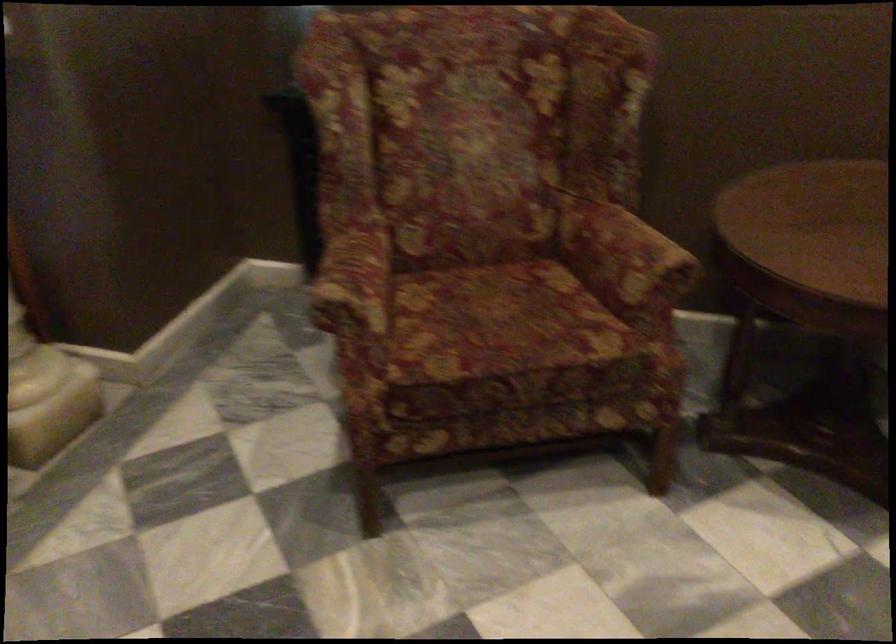
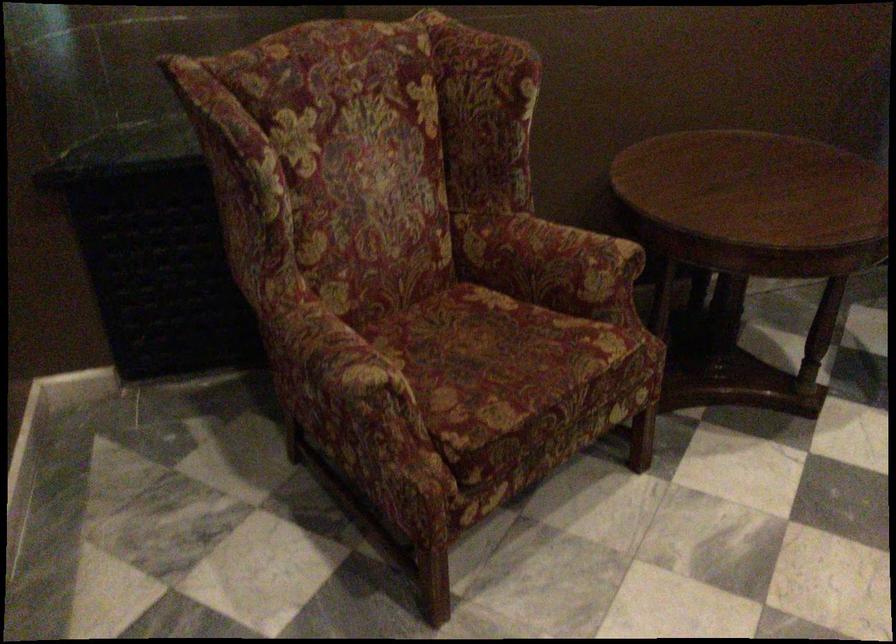
Locate, in the second image, the point that corresponds to the point at 314,297 in the first image.

(343, 389)